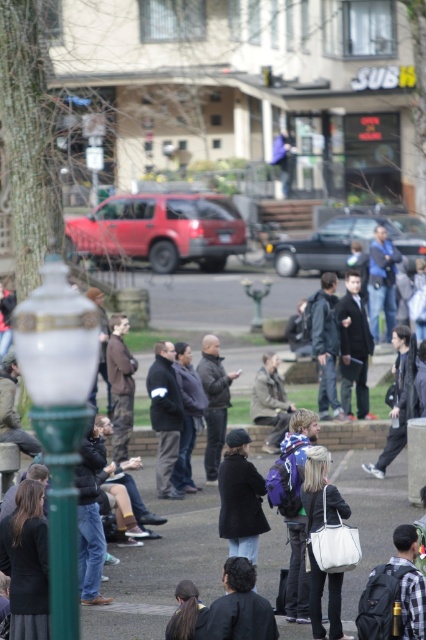
Question: Which point is closer to the camera taking this photo?

Choices:
 (A) (386, 502)
 (B) (400, 433)
 (C) (333, 604)
 (D) (81, 328)

Answer: (D)

Question: Is matte black jacket at center bigger than green glass lamp post at left?

Choices:
 (A) no
 (B) yes

Answer: (A)

Question: Can you confirm if green glass lamp post at left is wider than dark gray jacket at center?

Choices:
 (A) yes
 (B) no

Answer: (A)

Question: Is dark gray jacket at lower center above dark gray jacket at center?

Choices:
 (A) yes
 (B) no

Answer: (B)

Question: Estimate the real-world distances between objects in this image. Which object is farther from the matte black jacket at center?

Choices:
 (A) dark gray jacket at lower center
 (B) concrete pavement at center
 (C) white leather handbag at center

Answer: (A)

Question: Estimate the real-world distances between objects in this image. Which object is farther from the white leather handbag at center?

Choices:
 (A) dark gray jacket at lower center
 (B) dark gray jacket at center
 (C) green glass lamp post at left

Answer: (B)